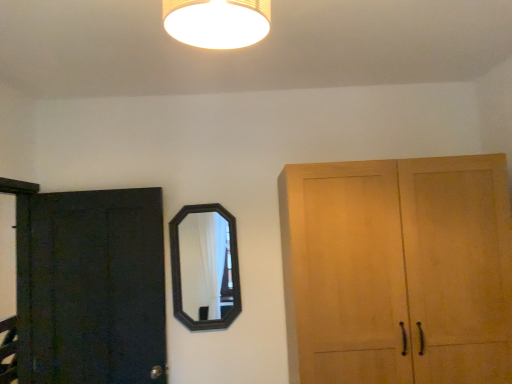
Question: Is black wooden mirror at center positioned with its back to matte yellow lampshade at upper center?

Choices:
 (A) no
 (B) yes

Answer: (A)

Question: Does black wooden mirror at center appear on the right side of matte yellow lampshade at upper center?

Choices:
 (A) yes
 (B) no

Answer: (B)

Question: Considering the relative sizes of black wooden mirror at center and matte yellow lampshade at upper center in the image provided, is black wooden mirror at center taller than matte yellow lampshade at upper center?

Choices:
 (A) no
 (B) yes

Answer: (B)

Question: Is black wooden mirror at center bigger than matte yellow lampshade at upper center?

Choices:
 (A) yes
 (B) no

Answer: (A)

Question: Does black wooden mirror at center have a smaller size compared to matte yellow lampshade at upper center?

Choices:
 (A) yes
 (B) no

Answer: (B)

Question: Is black wooden mirror at center wider than matte yellow lampshade at upper center?

Choices:
 (A) yes
 (B) no

Answer: (B)

Question: Does dark matte wood door at left have a greater height compared to black wooden mirror at center?

Choices:
 (A) no
 (B) yes

Answer: (B)

Question: Is dark matte wood door at left next to black wooden mirror at center?

Choices:
 (A) no
 (B) yes

Answer: (A)

Question: Is dark matte wood door at left far from black wooden mirror at center?

Choices:
 (A) no
 (B) yes

Answer: (A)

Question: From a real-world perspective, is dark matte wood door at left on top of black wooden mirror at center?

Choices:
 (A) yes
 (B) no

Answer: (B)

Question: Is dark matte wood door at left closer to the viewer compared to black wooden mirror at center?

Choices:
 (A) yes
 (B) no

Answer: (A)

Question: From the image's perspective, does dark matte wood door at left appear lower than black wooden mirror at center?

Choices:
 (A) yes
 (B) no

Answer: (A)

Question: Considering the relative positions of black wooden mirror at center and dark matte wood door at left in the image provided, is black wooden mirror at center to the left of dark matte wood door at left from the viewer's perspective?

Choices:
 (A) yes
 (B) no

Answer: (B)